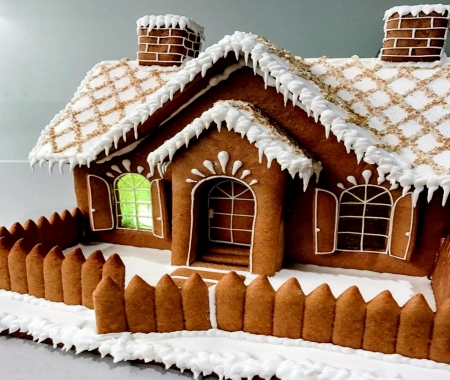
Identify the location of door. click(x=235, y=216).